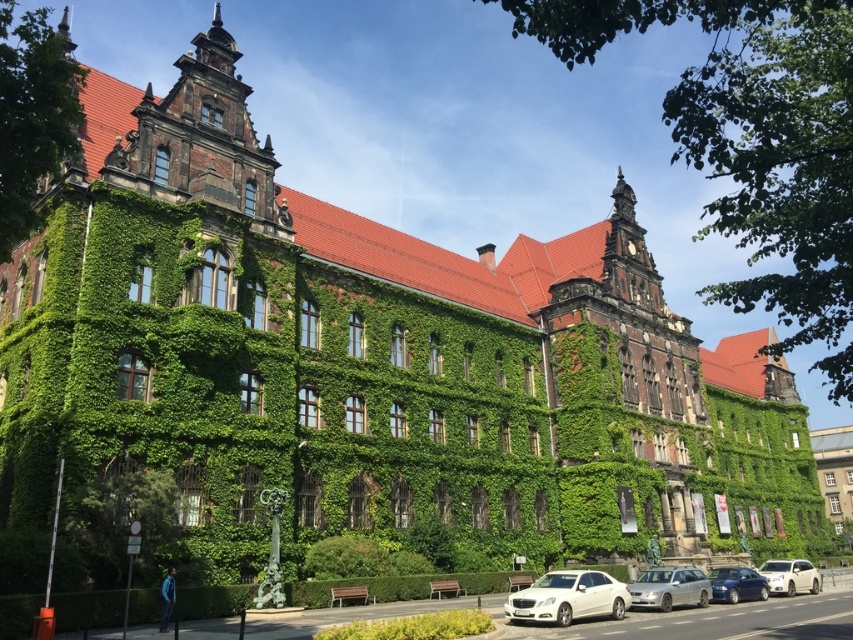
You are standing in front of the historic building and notice two points marked on its facade. The first point is at coordinates point (534,609) and the second is at point (730,602). Which of these two points is closer to you as you face the building?

Point (534,609) is in front of point (730,602), so the first point is closer to you.